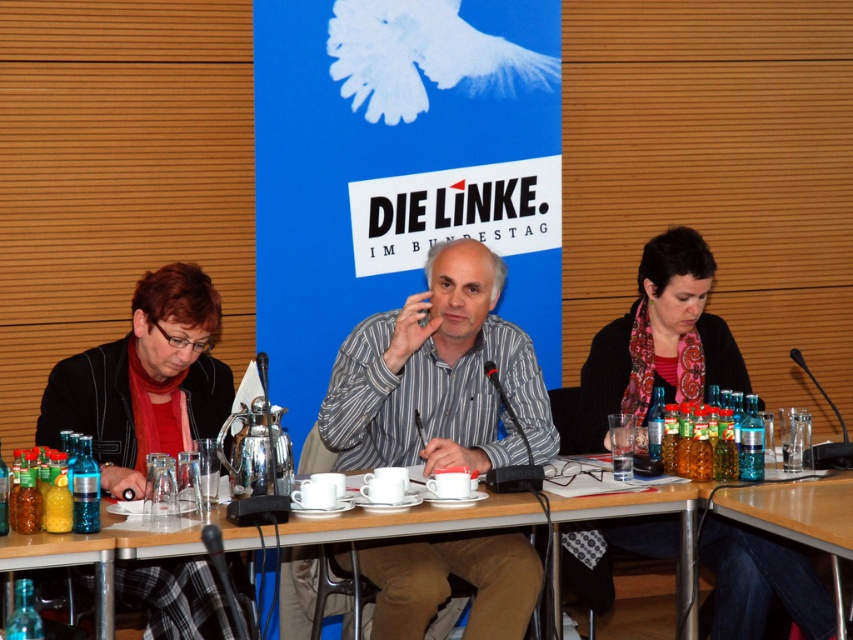
Question: Among these points, which one is nearest to the camera?

Choices:
 (A) pos(548,428)
 (B) pos(726,609)
 (C) pos(839,540)

Answer: (C)

Question: Does wooden table at center lie behind wooden table at lower right?

Choices:
 (A) no
 (B) yes

Answer: (A)

Question: Among these points, which one is farthest from the camera?

Choices:
 (A) (761, 628)
 (B) (129, 557)
 (C) (834, 627)
 (D) (554, 428)

Answer: (D)

Question: Which object is closer to the camera taking this photo?

Choices:
 (A) wooden table at center
 (B) striped cotton shirt at center
 (C) dark gray sweater at center

Answer: (A)

Question: Does striped cotton shirt at center appear on the right side of wooden table at center?

Choices:
 (A) no
 (B) yes

Answer: (B)

Question: Can you confirm if striped cotton shirt at center is positioned below dark gray sweater at center?

Choices:
 (A) yes
 (B) no

Answer: (A)